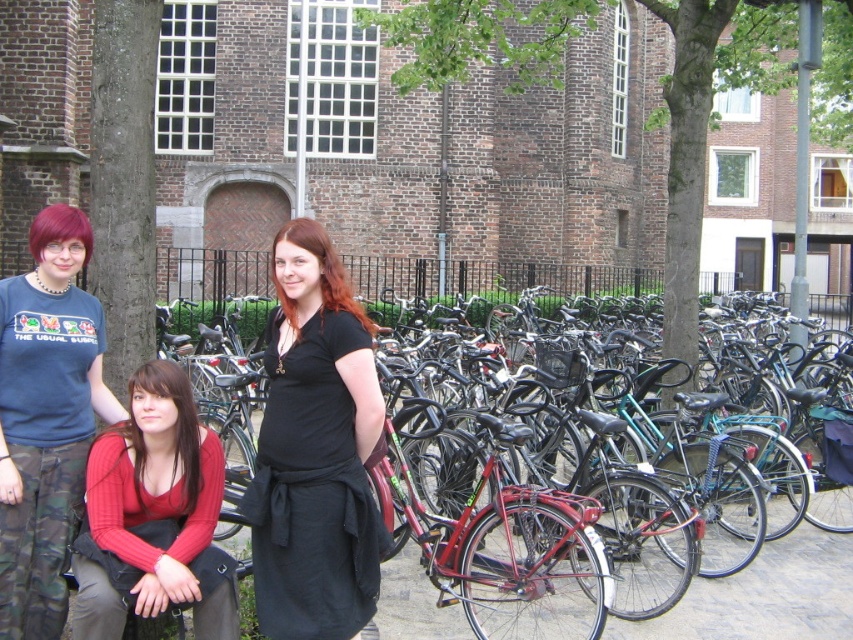
You are a photographer adjusting your camera to focus on two points in the scene. One point is at coordinate point (776, 84) and the other is at point (129, 502). If you focus on the closer point, will the farther point still be in focus? Assume your camera has a depth of field that can cover objects within 0.2 units of the focused point.

The point at (776, 84) is further from the camera than point (129, 502). If you focus on the closer point (129, 502), the depth of field extends from 0.787 to 0.987. Since 0.134 is outside this range, the farther point will not be in focus.

Consider the image. You are a photographer trying to capture a group photo of the people and the building. The black matte dress at center and the shiny red bicycle at center are currently 74.57 feet apart. If you want to frame both in the same shot without moving either object, is this possible given the camera you have that has a maximum focal length allowing a 50 feet field of view?

The distance between the black matte dress at center and the shiny red bicycle at center is 74.57 feet, which exceeds the camera field of view of 50 feet. Therefore, it is not possible to frame both in the same shot without moving either object.

You are a photographer trying to capture a photo of the green leafy tree at center and the knitted red sweater at lower left. You want to ensure both are in the frame. Based on their positions, which object should you position closer to the left side of your camera viewfinder?

The knitted red sweater at lower left should be positioned closer to the left side of the camera viewfinder since it is located to the left of the green leafy tree at center.